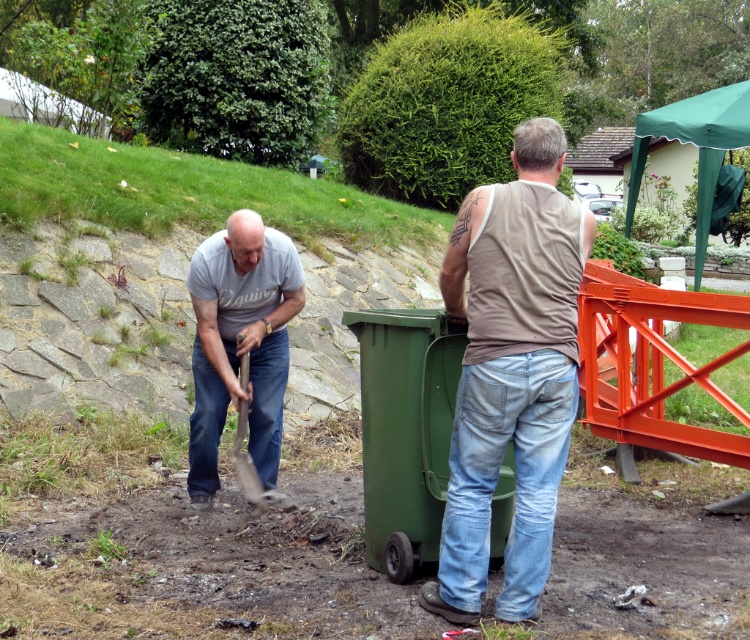
Question: Estimate the real-world distances between objects in this image. Which object is closer to the green plastic bin at center?

Choices:
 (A) wooden handle shovel at lower center
 (B) matte gray t-shirt at center

Answer: (B)

Question: Where is brown cotton tank top at center located in relation to matte gray t-shirt at center in the image?

Choices:
 (A) above
 (B) below

Answer: (A)

Question: Among these points, which one is farthest from the camera?

Choices:
 (A) (249, 460)
 (B) (456, 440)
 (C) (447, 406)

Answer: (A)

Question: Among these objects, which one is nearest to the camera?

Choices:
 (A) green plastic bin at center
 (B) brushed stone hillside at lower left
 (C) brown cotton tank top at center

Answer: (C)

Question: Does matte gray t-shirt at center appear under wooden handle shovel at lower center?

Choices:
 (A) yes
 (B) no

Answer: (B)

Question: Considering the relative positions of brown cotton tank top at center and wooden handle shovel at lower center in the image provided, where is brown cotton tank top at center located with respect to wooden handle shovel at lower center?

Choices:
 (A) above
 (B) below

Answer: (A)